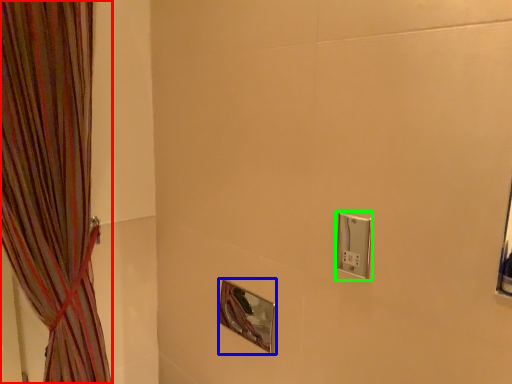
Question: Estimate the real-world distances between objects in this image. Which object is farther from curtain (highlighted by a red box), mirror (highlighted by a blue box) or light switch (highlighted by a green box)?

Choices:
 (A) mirror
 (B) light switch

Answer: (B)